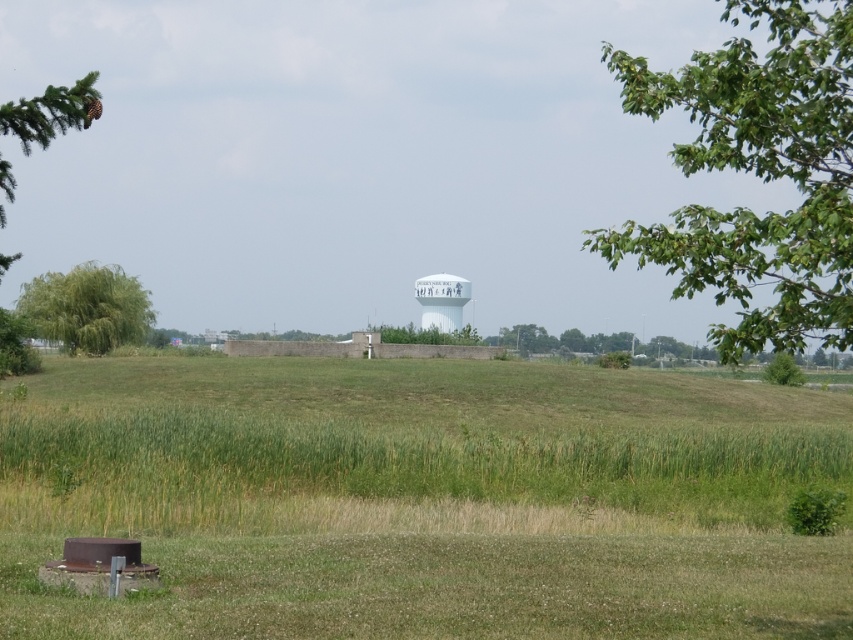
You are a drone operator who needs to fly a drone from the green leafy tree at upper right to the green textured pine branch at upper left. The drone has a maximum flight range of 30 meters. Can the drone complete this flight without needing a recharge?

The distance between the green leafy tree at upper right and the green textured pine branch at upper left is 33.70 meters. Since the drone can only fly 30 meters before needing a recharge, it cannot complete the flight without recharging.

You are standing in the middle of the field and looking towards the white water tower. Which object is closer to the water tower, the green leafy tree at upper right or the green textured pine branch at upper left?

The green leafy tree at upper right is closer to the water tower because it is positioned over the green textured pine branch at upper left, indicating it is in a more forward position relative to the water tower.